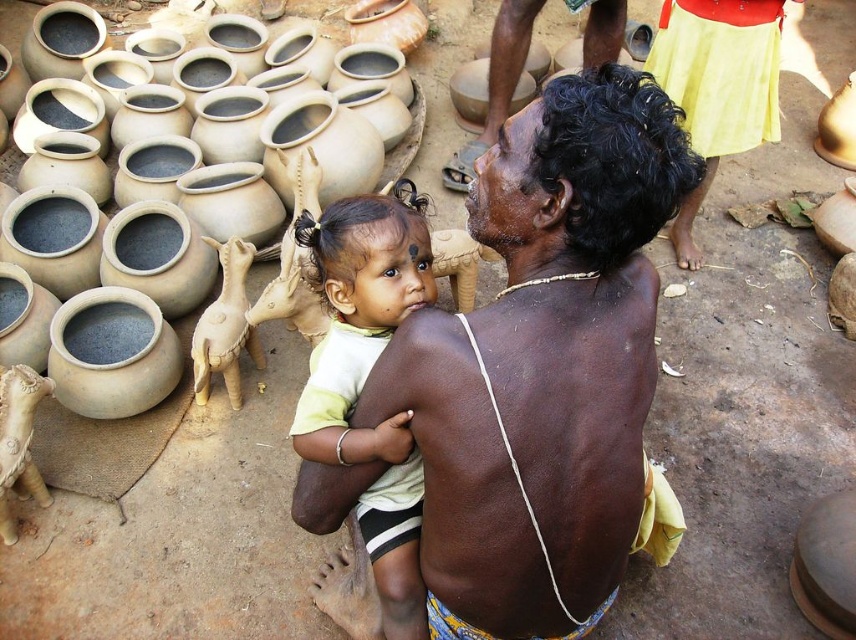
You are a delivery person who needs to place a package between the matte yellow shirt at center and the matte clay pot at left. The package requires at least 5 feet of space to be placed safely. Can you fit the package there?

The distance between the matte yellow shirt at center and the matte clay pot at left is 7.29 feet, which is more than the required 5 feet. Therefore, the package can be safely placed between them.

Based on the photo, you are standing in the rural setting shown in the image. You need to reach the matte yellow shirt at center to hand it to the man. The shirt is placed 4.78 feet away from you. If your maximum reach without moving is 4 feet, will you be able to hand him the shirt without taking a step forward?

The matte yellow shirt at center is 4.78 feet from the camera, which is beyond your maximum reach of 4 feet. Therefore, you will need to take a step forward to hand the shirt to the man.